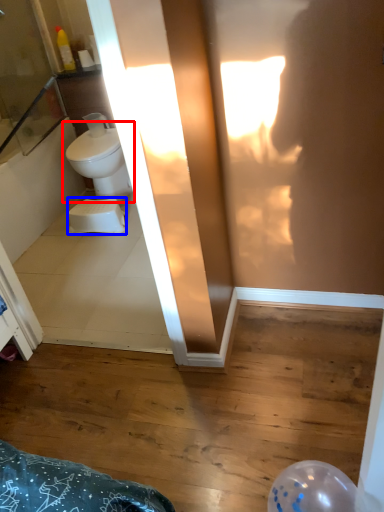
Question: Which object appears closest to the camera in this image, toilet (highlighted by a red box) or toilet bowl (highlighted by a blue box)?

Choices:
 (A) toilet
 (B) toilet bowl

Answer: (B)